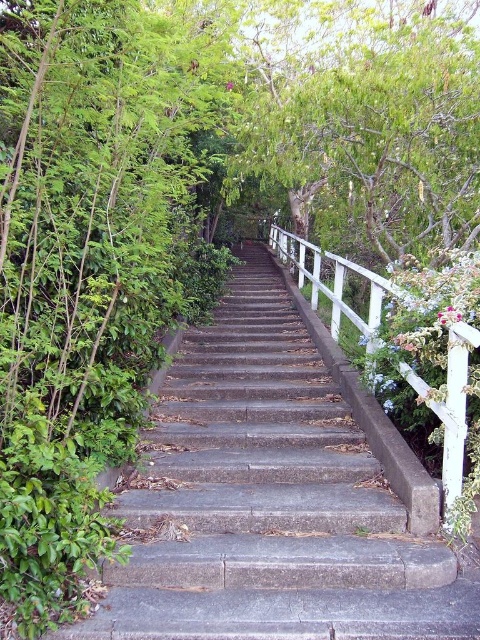
You are a delivery person carrying a heavy package and need to climb the gray concrete stairs at center. The white wooden rail at right is nearby. Can you use the rail for support while climbing?

Yes, you can use the white wooden rail at right for support while climbing the gray concrete stairs at center since the rail is positioned above the stairs.

You are a maintenance worker needing to reach the white wooden rail at right from the gray concrete stairs at center. The tools you carry are 6 meters long. Can you safely extend the tools from the stairs to the rail without overextending?

The gray concrete stairs at center is 5.54 meters away from the white wooden rail at right. Since the tools are 6 meters long, which is longer than the distance between them, you can safely extend the tools from the stairs to the rail without overextending.

You are a painter who needs to paint both the gray concrete stairs at center and the white wooden rail at right. If you have a limited amount of paint, which object would require less paint due to its size?

The gray concrete stairs at center is smaller than the white wooden rail at right, so it would require less paint.